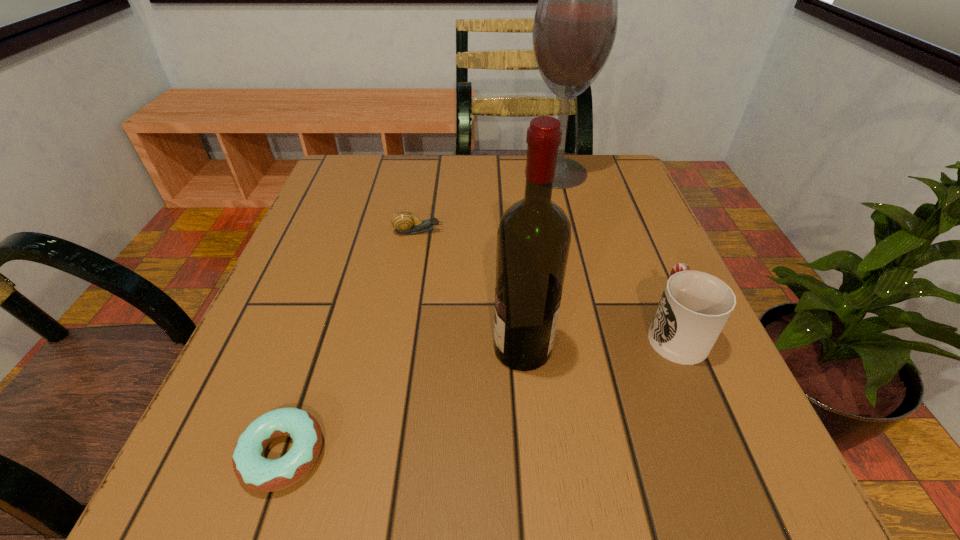
In order to click on vacant area located on the front and back of the nearer alcohol in this screenshot , I will do `click(340, 349)`.

Locate an element on the screen. This screenshot has height=540, width=960. blank space located 0.280m on the front and back of the nearer alcohol is located at coordinates (314, 349).

The height and width of the screenshot is (540, 960). I want to click on free space located 0.360m on the handle side of the third shortest object, so click(x=615, y=190).

Find the location of a particular element. Image resolution: width=960 pixels, height=540 pixels. free space located 0.100m on the handle side of the third shortest object is located at coordinates (646, 263).

I want to click on free space located 0.300m on the handle side of the third shortest object, so click(621, 204).

The height and width of the screenshot is (540, 960). In order to click on free space located on the front-facing side of the fourth tallest object in this screenshot , I will do `click(487, 232)`.

Identify the location of free location located 0.270m on the right of the doughnut. (535, 454).

Where is `object that is positioned at the far edge`? This screenshot has width=960, height=540. object that is positioned at the far edge is located at coordinates (575, 24).

The image size is (960, 540). In order to click on object that is at the near edge in this screenshot , I will do `click(252, 469)`.

Where is `object that is positioned at the left edge`? This screenshot has height=540, width=960. object that is positioned at the left edge is located at coordinates (252, 469).